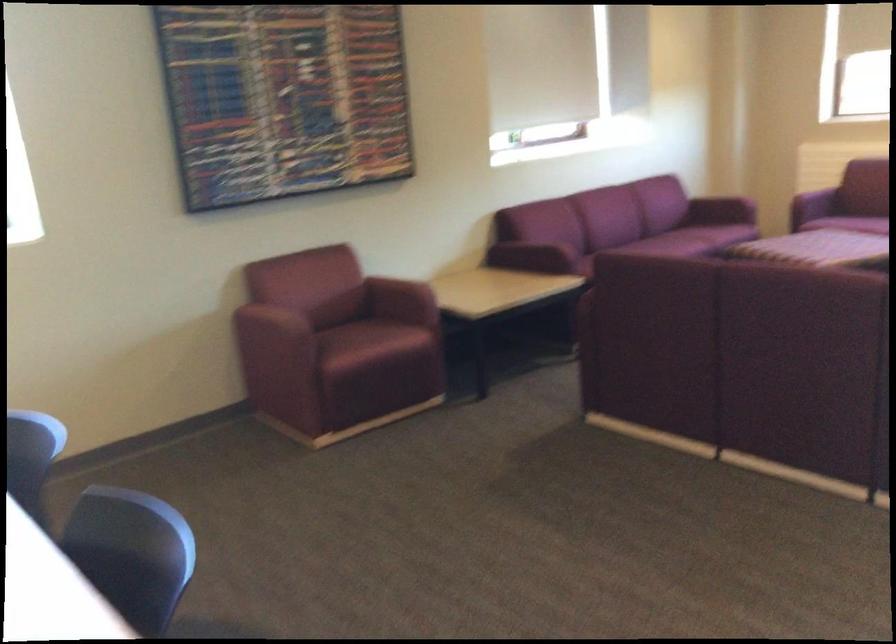
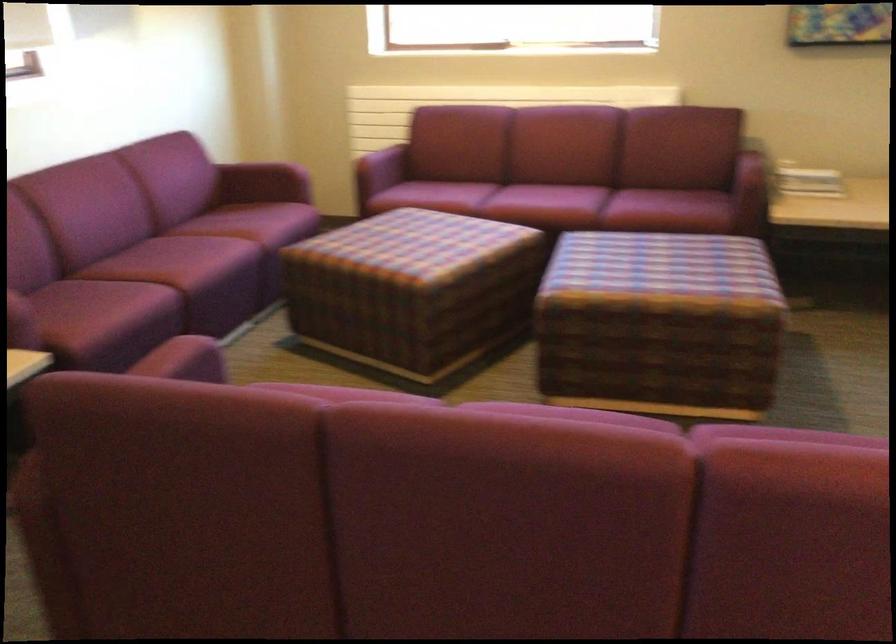
Where in the second image is the point corresponding to (x=726, y=205) from the first image?

(269, 173)